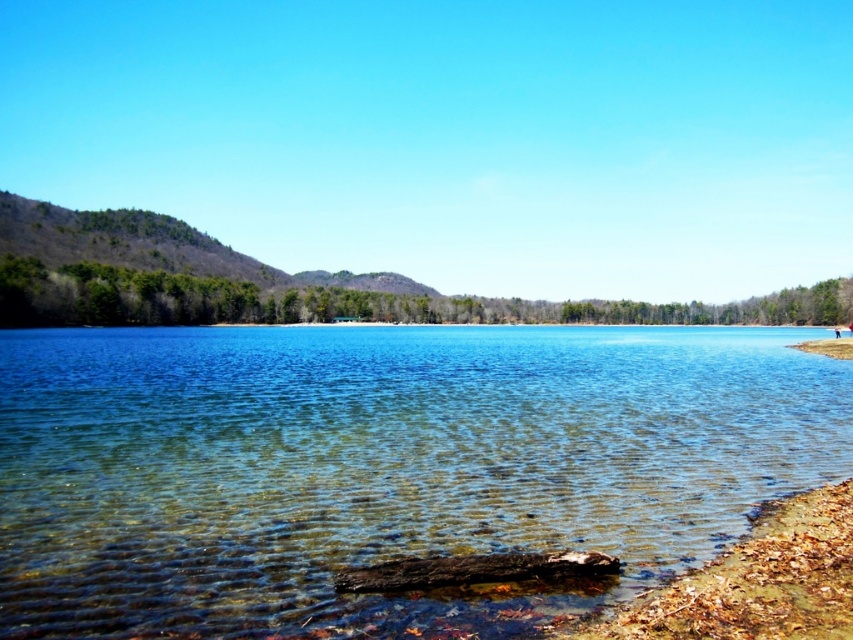
You are planning to build a small dock for fishing. You need to choose between placing it on the clear water at center or the brown dirt shoreline at lower right. Based on their widths, which location would allow for a wider dock structure?

The clear water at center has a greater width than the brown dirt shoreline at lower right, so placing the dock on the clear water at center would allow for a wider dock structure.

You are standing at the lakeside and want to take a photo of both the point at coordinates point (747, 560) and point (820, 346). To ensure both points are in the frame, which point should you focus on first?

You should focus on point (747, 560) first because it is closer to you than point (820, 346), which is further away. By focusing on the closer point, both points will be in focus due to the depth of field.